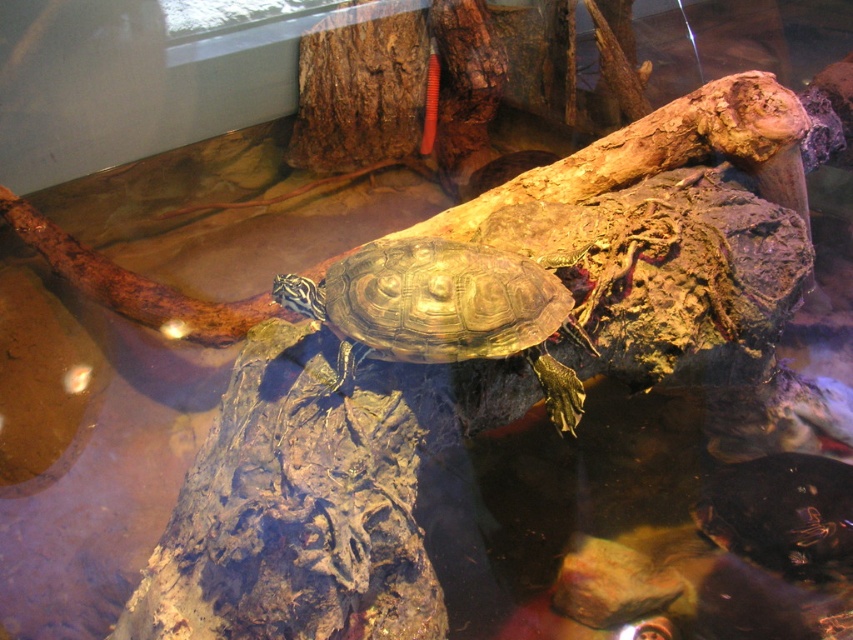
Question: Is shiny brown tortoise at center in front of shiny dark green tortoise at center?

Choices:
 (A) no
 (B) yes

Answer: (B)

Question: Does shiny brown tortoise at center have a larger size compared to shiny dark green tortoise at center?

Choices:
 (A) no
 (B) yes

Answer: (B)

Question: Is shiny brown tortoise at center thinner than shiny dark green tortoise at center?

Choices:
 (A) no
 (B) yes

Answer: (A)

Question: Which point is closer to the camera taking this photo?

Choices:
 (A) (824, 557)
 (B) (572, 380)

Answer: (B)